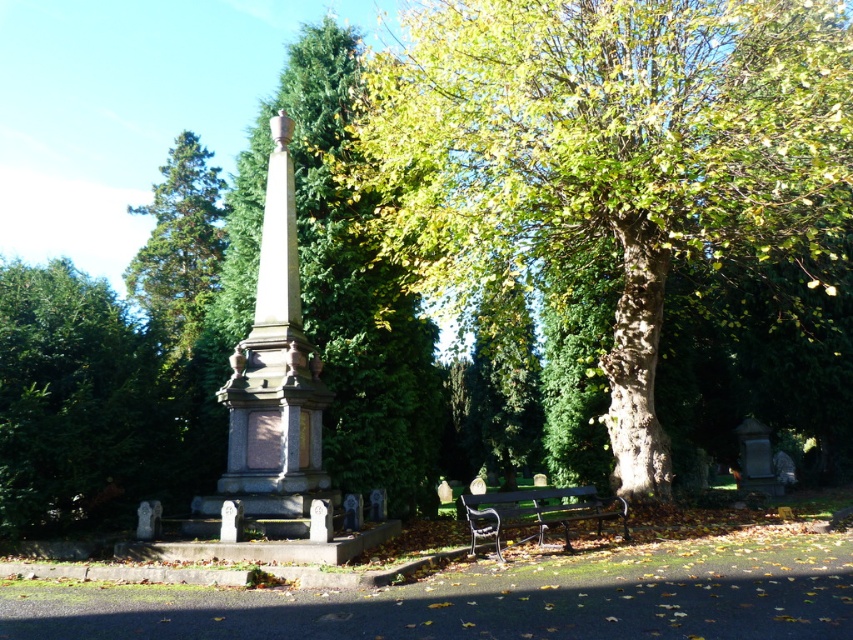
Question: Can you confirm if green rough bark tree at center is wider than polished stone obelisk at center?

Choices:
 (A) no
 (B) yes

Answer: (A)

Question: Can you confirm if green textured tree at center is thinner than green textured stone monument at center?

Choices:
 (A) yes
 (B) no

Answer: (B)

Question: Which point is farther to the camera?

Choices:
 (A) green rough bark tree at center
 (B) green textured tree at center

Answer: (B)

Question: Is green textured tree at center further to camera compared to black metal bench at center?

Choices:
 (A) yes
 (B) no

Answer: (A)

Question: Which of the following is the farthest from the observer?

Choices:
 (A) black metal bench at center
 (B) green textured stone monument at center

Answer: (B)

Question: Which of the following is the closest to the observer?

Choices:
 (A) black metal bench at center
 (B) green rough bark tree at center
 (C) green textured stone monument at center
 (D) green textured tree at center

Answer: (A)